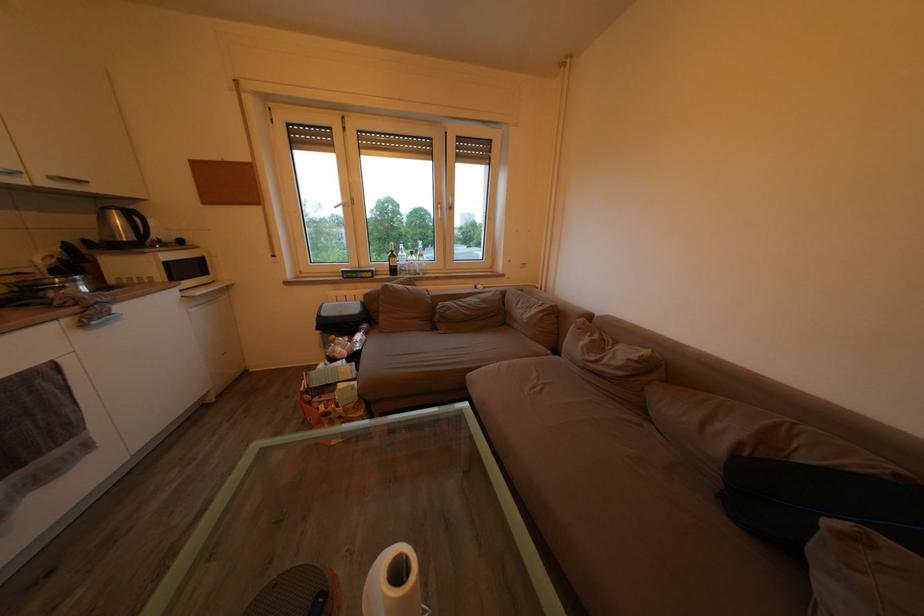
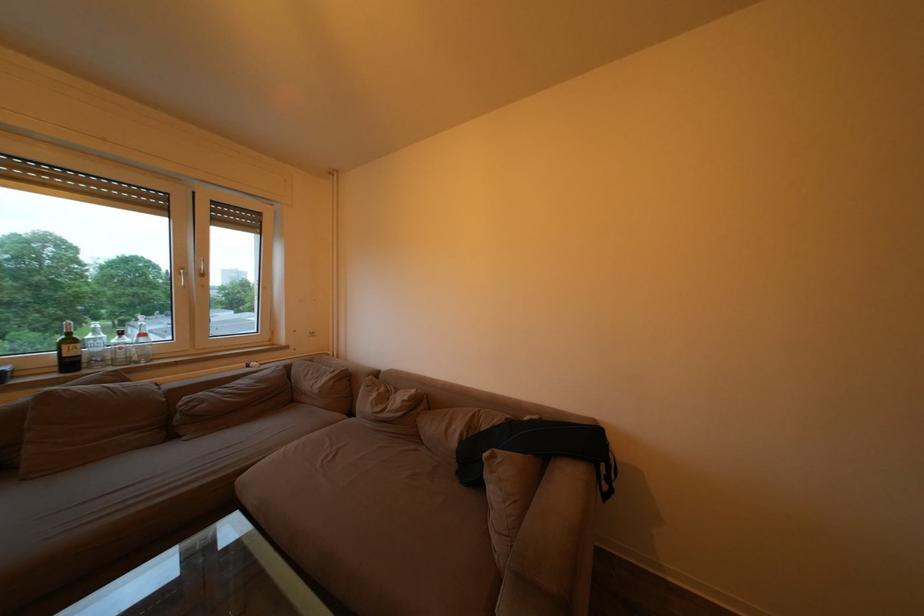
Find the pixel in the second image that matches (x=529, y=297) in the first image.

(319, 367)